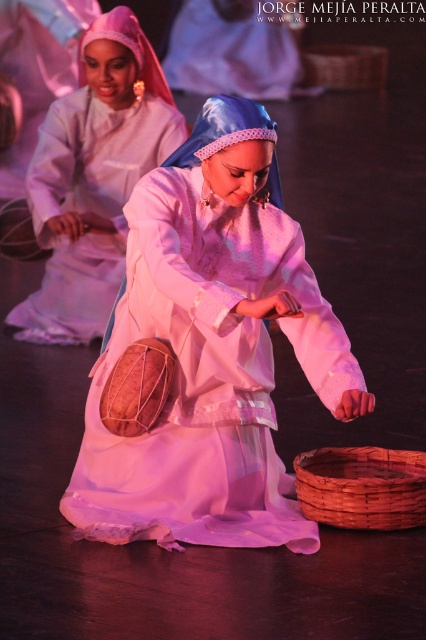
Can you confirm if brown woven basket at lower center is wider than woven brown basket at center?

No.

Locate an element on the screen. The height and width of the screenshot is (640, 426). brown woven basket at lower center is located at coordinates (362, 486).

Measure the distance between point (166, 184) and camera.

A distance of 10.95 feet exists between point (166, 184) and camera.

Is matte white dress at center wider than woven brown basket at center?

Yes, matte white dress at center is wider than woven brown basket at center.

Describe the element at coordinates (212, 349) in the screenshot. I see `matte white dress at center` at that location.

You are a GUI agent. You are given a task and a screenshot of the screen. Output one action in this format:
    pyautogui.click(x=<x>, y=<y>)
    Task: Click on the matte white dress at center
    
    Given the screenshot: What is the action you would take?
    pyautogui.click(x=212, y=349)

Can you confirm if matte white fabric at center is bigger than woven brown basket at center?

Correct, matte white fabric at center is larger in size than woven brown basket at center.

Which is more to the left, matte white fabric at center or woven brown basket at center?

matte white fabric at center is more to the left.

Does point (78, 211) come in front of point (316, 84)?

That is True.

At what (x,y) coordinates should I click in order to perform the action: click on matte white fabric at center. Please return your answer as a coordinate pair (x, y). This screenshot has height=640, width=426. Looking at the image, I should click on (94, 179).